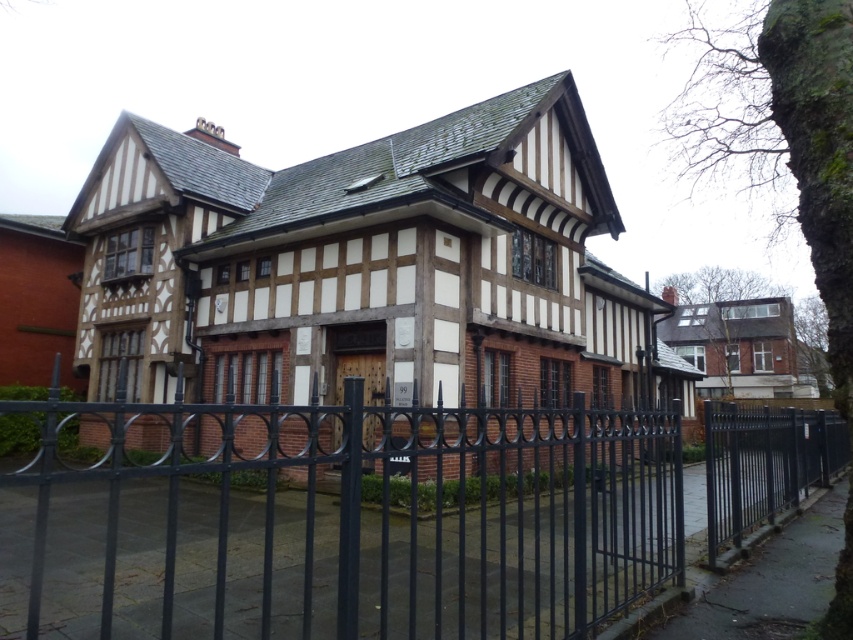
Between black metal fence at center and black metal fence at right, which one is positioned higher?

black metal fence at right is higher up.

Is black metal fence at center further to camera compared to black metal fence at right?

No, it is in front of black metal fence at right.

Is point (112, 531) closer to camera compared to point (804, 488)?

Yes, point (112, 531) is in front of point (804, 488).

Find the location of `black metal fence at center`. black metal fence at center is located at coordinates (347, 516).